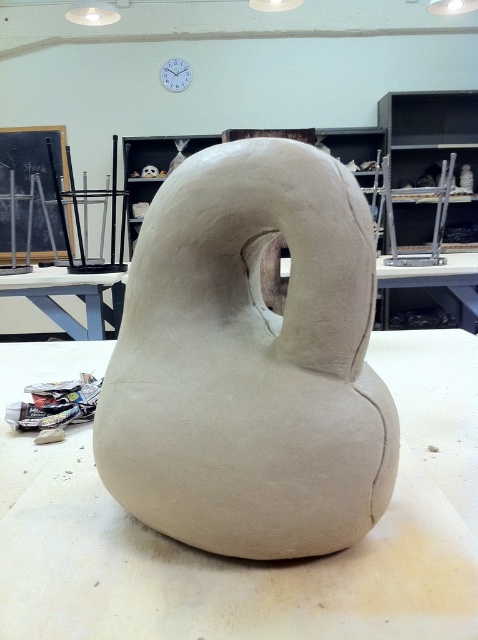
Question: Which object is farther from the camera taking this photo?

Choices:
 (A) white matte table at center
 (B) white plastic clock at upper center
 (C) white clay sculpture at center

Answer: (B)

Question: Is clay sculpture at center below white matte table at center?

Choices:
 (A) yes
 (B) no

Answer: (A)

Question: Which of the following is the closest to the observer?

Choices:
 (A) (119, 337)
 (B) (402, 339)
 (C) (9, 289)

Answer: (A)

Question: Which object is positioned farthest from the white matte table at center?

Choices:
 (A) white plastic clock at upper center
 (B) white clay sculpture at center

Answer: (A)

Question: Is white clay sculpture at center thinner than white plastic clock at upper center?

Choices:
 (A) no
 (B) yes

Answer: (A)

Question: Can you confirm if clay sculpture at center is positioned above white plastic clock at upper center?

Choices:
 (A) no
 (B) yes

Answer: (A)